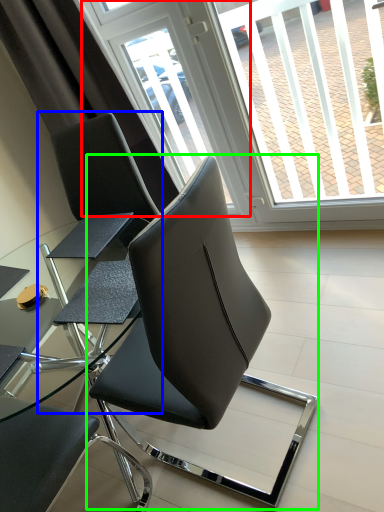
Question: Which object is positioned closest to screen door (highlighted by a red box)? Select from chair (highlighted by a blue box) and chair (highlighted by a green box).

Choices:
 (A) chair
 (B) chair

Answer: (A)